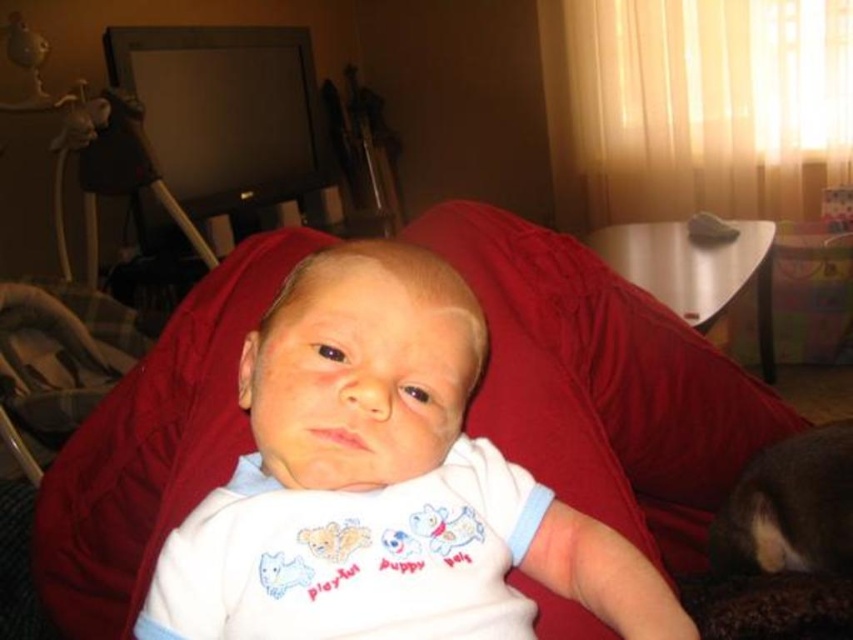
Question: Is white soft fabric baby at center below metallic gray armchair at left?

Choices:
 (A) no
 (B) yes

Answer: (B)

Question: Which point is farther to the camera?

Choices:
 (A) 363,518
 (B) 4,312

Answer: (B)

Question: Can you confirm if white soft fabric baby at center is positioned to the left of metallic gray armchair at left?

Choices:
 (A) yes
 (B) no

Answer: (B)

Question: Does white soft fabric baby at center appear over metallic gray armchair at left?

Choices:
 (A) no
 (B) yes

Answer: (A)

Question: Which point is farther to the camera?

Choices:
 (A) metallic gray armchair at left
 (B) white soft fabric baby at center

Answer: (A)